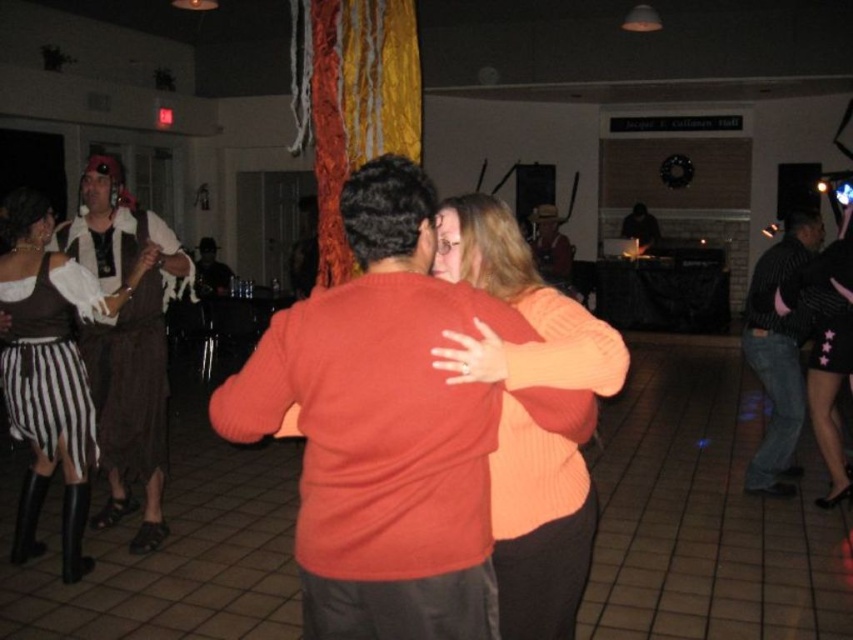
Question: Does knitted sweater at center appear on the right side of knitted peach sweater at center?

Choices:
 (A) no
 (B) yes

Answer: (A)

Question: Which point is farther to the camera?

Choices:
 (A) (61, 449)
 (B) (386, 301)

Answer: (A)

Question: Is knitted sweater at center below black striped shirt at right?

Choices:
 (A) yes
 (B) no

Answer: (A)

Question: Which is farther from the knitted sweater at center?

Choices:
 (A) knitted peach sweater at center
 (B) black striped shirt at right
 (C) brown leather jacket at center
 (D) striped fabric skirt at left

Answer: (C)

Question: Can you confirm if knitted sweater at center is wider than knitted peach sweater at center?

Choices:
 (A) no
 (B) yes

Answer: (B)

Question: Which of these objects is positioned closest to the brown leather jacket at center?

Choices:
 (A) black striped shirt at right
 (B) striped fabric skirt at left
 (C) knitted peach sweater at center
 (D) knitted sweater at center

Answer: (A)